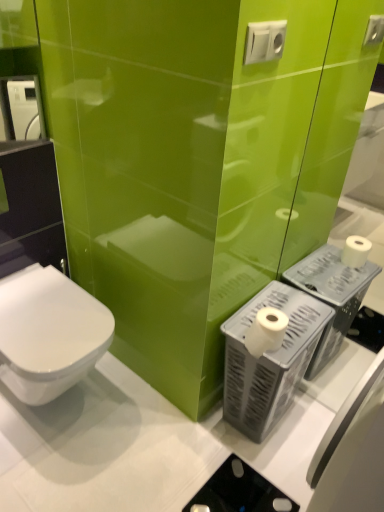
I want to click on vacant space situated on the left part of white plastic toilet paper holder at lower right, so click(x=191, y=434).